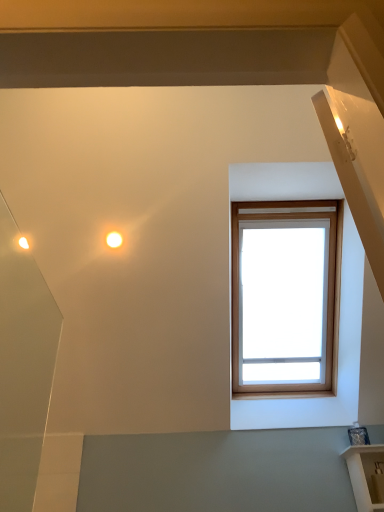
Question: From the image's perspective, is white glossy shelf at lower right located above or below matte white droplight at upper left?

Choices:
 (A) below
 (B) above

Answer: (A)

Question: In the image, is white glossy shelf at lower right positioned in front of or behind matte white droplight at upper left?

Choices:
 (A) behind
 (B) front

Answer: (B)

Question: From a real-world perspective, is white glossy shelf at lower right physically located above or below matte white droplight at upper left?

Choices:
 (A) below
 (B) above

Answer: (A)

Question: Is point (119, 245) positioned closer to the camera than point (369, 484)?

Choices:
 (A) closer
 (B) farther

Answer: (B)

Question: From the image's perspective, is matte white droplight at upper left above or below white glossy shelf at lower right?

Choices:
 (A) below
 (B) above

Answer: (B)

Question: In terms of width, does matte white droplight at upper left look wider or thinner when compared to white glossy shelf at lower right?

Choices:
 (A) wide
 (B) thin

Answer: (B)

Question: Relative to white glossy shelf at lower right, is matte white droplight at upper left in front or behind?

Choices:
 (A) front
 (B) behind

Answer: (B)